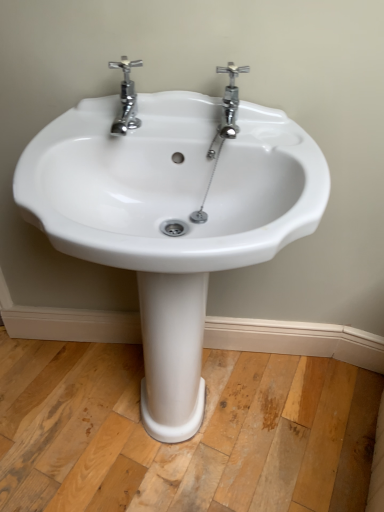
Question: Is chrome/metallic faucet at upper center, the first tap in the right-to-left sequence, positioned far away from chrome/metallic faucet at upper left, the first tap from the left?

Choices:
 (A) no
 (B) yes

Answer: (A)

Question: Is chrome/metallic faucet at upper center, marked as the 2th tap in a left-to-right arrangement, with chrome/metallic faucet at upper left, the first tap from the left?

Choices:
 (A) yes
 (B) no

Answer: (B)

Question: Can you confirm if chrome/metallic faucet at upper center, marked as the 2th tap in a left-to-right arrangement, is positioned to the right of chrome/metallic faucet at upper left, the first tap from the left?

Choices:
 (A) yes
 (B) no

Answer: (A)

Question: From a real-world perspective, is chrome/metallic faucet at upper center, the first tap in the right-to-left sequence, positioned over chrome/metallic faucet at upper left, positioned as the second tap in right-to-left order, based on gravity?

Choices:
 (A) yes
 (B) no

Answer: (B)

Question: Is chrome/metallic faucet at upper left, the first tap from the left, inside chrome/metallic faucet at upper center, marked as the 2th tap in a left-to-right arrangement?

Choices:
 (A) yes
 (B) no

Answer: (B)

Question: Is chrome/metallic faucet at upper center, marked as the 2th tap in a left-to-right arrangement, taller or shorter than white ceramic sink at center?

Choices:
 (A) tall
 (B) short

Answer: (B)

Question: Does point (233, 96) appear closer or farther from the camera than point (183, 200)?

Choices:
 (A) farther
 (B) closer

Answer: (B)

Question: From the image's perspective, is chrome/metallic faucet at upper center, the first tap in the right-to-left sequence, located above or below white ceramic sink at center?

Choices:
 (A) below
 (B) above

Answer: (B)

Question: From a real-world perspective, is chrome/metallic faucet at upper center, marked as the 2th tap in a left-to-right arrangement, physically located above or below white ceramic sink at center?

Choices:
 (A) above
 (B) below

Answer: (A)

Question: Which is correct: white ceramic sink at center is inside chrome/metallic faucet at upper center, marked as the 2th tap in a left-to-right arrangement, or outside of it?

Choices:
 (A) outside
 (B) inside

Answer: (A)

Question: Relative to chrome/metallic faucet at upper center, the first tap in the right-to-left sequence, is white ceramic sink at center in front or behind?

Choices:
 (A) behind
 (B) front

Answer: (B)

Question: Looking at the image, does white ceramic sink at center seem bigger or smaller compared to chrome/metallic faucet at upper center, marked as the 2th tap in a left-to-right arrangement?

Choices:
 (A) small
 (B) big

Answer: (B)

Question: Does point (185, 156) appear closer or farther from the camera than point (231, 109)?

Choices:
 (A) farther
 (B) closer

Answer: (B)

Question: Would you say chrome/metallic faucet at upper left, the first tap from the left, is to the left or to the right of chrome/metallic faucet at upper center, marked as the 2th tap in a left-to-right arrangement, in the picture?

Choices:
 (A) right
 (B) left

Answer: (B)

Question: From the image's perspective, relative to chrome/metallic faucet at upper center, marked as the 2th tap in a left-to-right arrangement, is chrome/metallic faucet at upper left, positioned as the second tap in right-to-left order, above or below?

Choices:
 (A) above
 (B) below

Answer: (A)